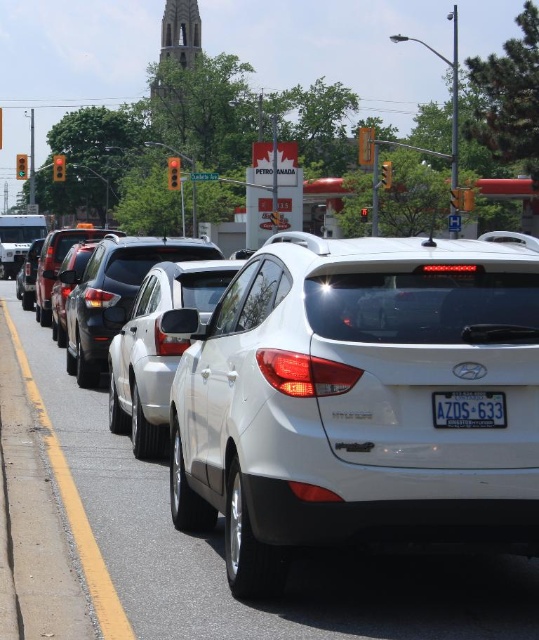
Question: Is green glass traffic light at center further to camera compared to metallic silver traffic light at center?

Choices:
 (A) yes
 (B) no

Answer: (A)

Question: Which object is positioned farthest from the metallic silver traffic light at center?

Choices:
 (A) red glass traffic light at center
 (B) green glass traffic light at center
 (C) yellow plastic traffic light at upper left
 (D) orange plastic traffic light at center

Answer: (B)

Question: Is shiny black sedan at center above green glass traffic light at upper left?

Choices:
 (A) no
 (B) yes

Answer: (A)

Question: Among these objects, which one is nearest to the camera?

Choices:
 (A) red glass traffic light at center
 (B) white plastic license plate at center
 (C) orange plastic traffic light at center

Answer: (B)

Question: Is green glass traffic light at center to the right of yellow matte traffic light at upper center from the viewer's perspective?

Choices:
 (A) no
 (B) yes

Answer: (A)

Question: Which of the following is the farthest from the observer?

Choices:
 (A) (362, 157)
 (B) (171, 340)

Answer: (A)